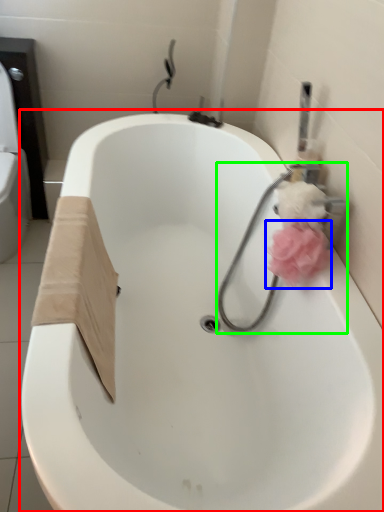
Question: Which object is positioned closest to bathtub (highlighted by a red box)? Select from flower (highlighted by a blue box) and plumbing fixture (highlighted by a green box).

Choices:
 (A) flower
 (B) plumbing fixture

Answer: (B)